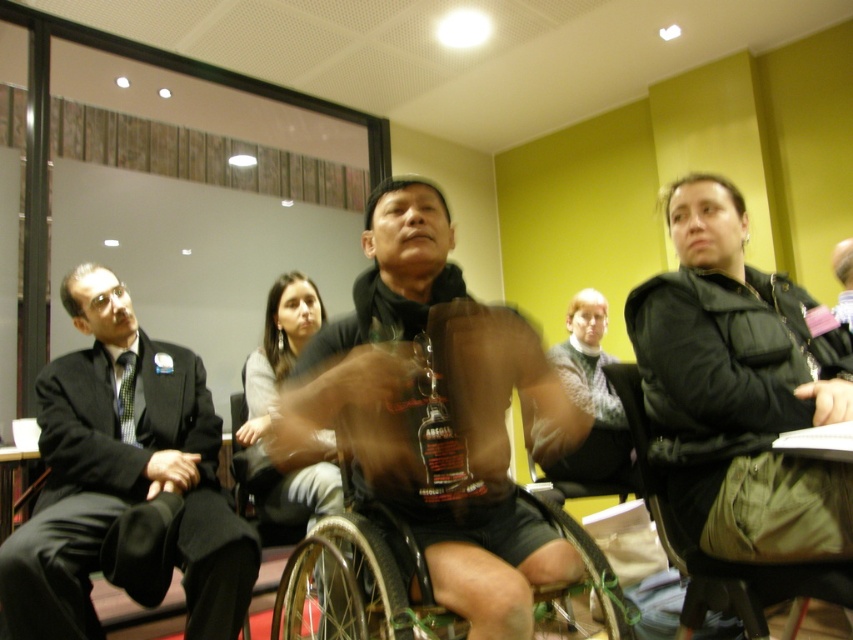
Question: Can you confirm if black plastic wheelchair at center is positioned above black fabric chair at right?

Choices:
 (A) yes
 (B) no

Answer: (B)

Question: Is matte black wheelchair at center above black plastic wheelchair at center?

Choices:
 (A) yes
 (B) no

Answer: (A)

Question: Based on their relative distances, which object is nearer to the matte black shirt at center?

Choices:
 (A) black fabric chair at right
 (B) matte black wheelchair at center

Answer: (A)

Question: Is black suit at left to the right of matte black shirt at center from the viewer's perspective?

Choices:
 (A) no
 (B) yes

Answer: (A)

Question: Based on their relative distances, which object is farther from the black fabric chair at right?

Choices:
 (A) matte black shirt at center
 (B) black suit at left
 (C) matte black wheelchair at center

Answer: (B)

Question: Among these points, which one is nearest to the camera?

Choices:
 (A) (602, 461)
 (B) (631, 627)

Answer: (B)